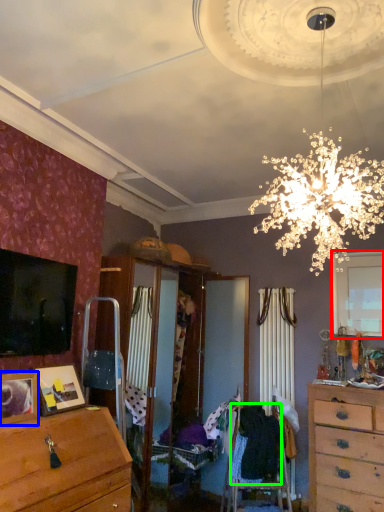
Question: Which object is the closest to the window (highlighted by a red box)? Choose among these: picture frame (highlighted by a blue box) or clothing (highlighted by a green box).

Choices:
 (A) picture frame
 (B) clothing

Answer: (B)